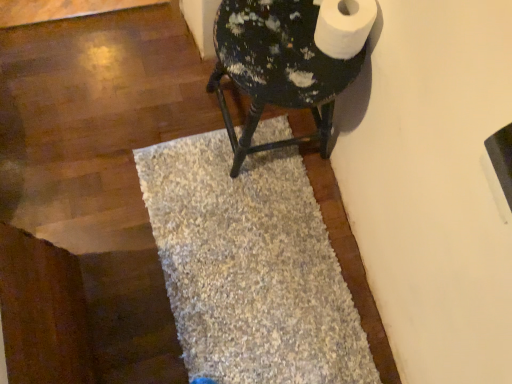
The height and width of the screenshot is (384, 512). I want to click on empty space that is ontop of painted wood stool at upper right (from a real-world perspective), so point(283,44).